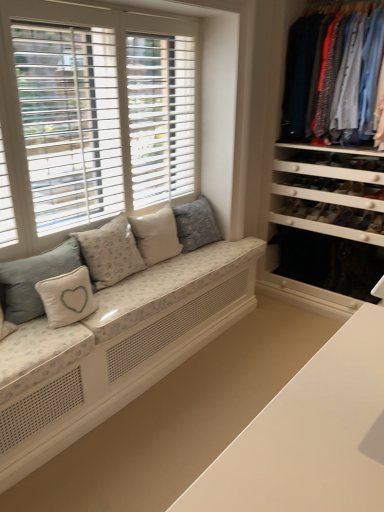
Question: From their relative heights in the image, would you say white wood window at left is taller or shorter than light blue cotton shirts at right?

Choices:
 (A) tall
 (B) short

Answer: (A)

Question: Looking at their shapes, would you say white wood window at left is wider or thinner than light blue cotton shirts at right?

Choices:
 (A) thin
 (B) wide

Answer: (A)

Question: Based on their relative distances, which object is farther from the white wood window at left?

Choices:
 (A) light blue cotton shirts at right
 (B) white fabric pillow with heart design at left, placed as the 2th pillow when sorted from left to right
 (C) light blue fabric pillow with heart design at lower left, which ranks as the fifth pillow in right-to-left order
 (D) light beige fabric pillow at center, marked as the fourth pillow in a left-to-right arrangement
 (E) light beige fabric couch at lower left

Answer: (A)

Question: Which is nearer to the light beige fabric couch at lower left?

Choices:
 (A) white wood window at left
 (B) light beige fabric pillow with heart design at center-left, which appears as the 3th pillow when viewed from the right
 (C) white fabric pillow with heart design at left, the 4th pillow from the right
 (D) light beige fabric pillow at center, marked as the fourth pillow in a left-to-right arrangement
 (E) light blue cotton shirts at right

Answer: (B)